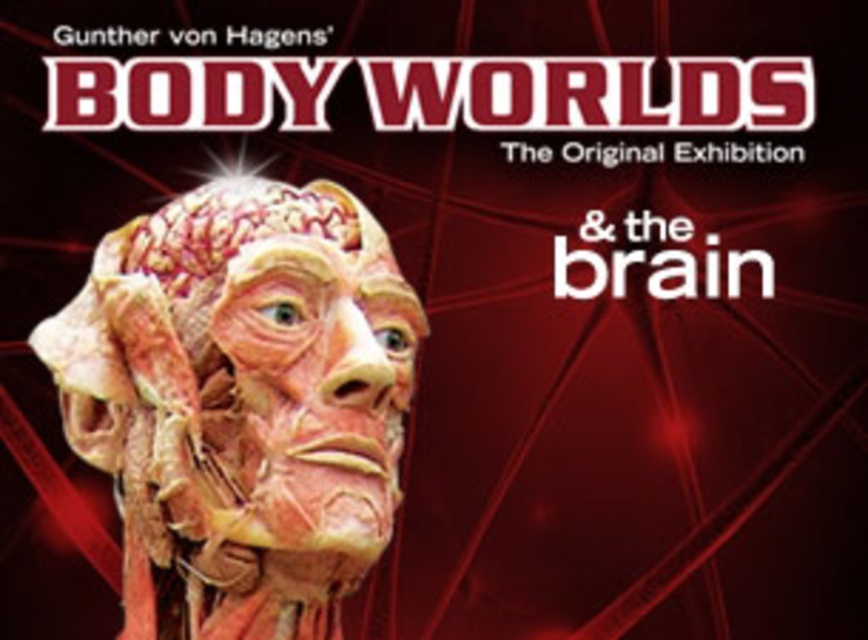
Between smooth flesh-colored head at center and pinkish flesh-colored muscle at center, which one appears on the right side from the viewer's perspective?

From the viewer's perspective, smooth flesh-colored head at center appears more on the right side.

Which is behind, point (97, 454) or point (418, 317)?

The point (418, 317) is behind.

The width and height of the screenshot is (868, 640). Identify the location of smooth flesh-colored head at center. (241, 403).

Where is `smooth flesh-colored head at center`? This screenshot has width=868, height=640. smooth flesh-colored head at center is located at coordinates (241, 403).